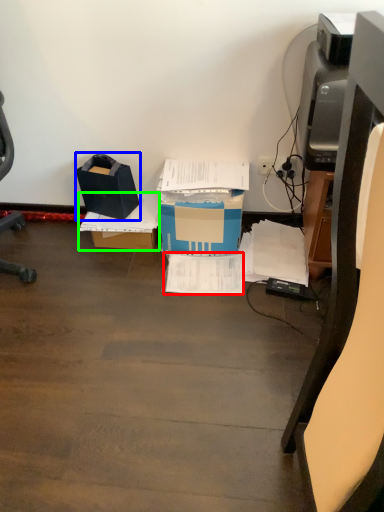
Question: Based on their relative distances, which object is farther from document (highlighted by a red box)? Choose from box (highlighted by a blue box) and cardboard box (highlighted by a green box).

Choices:
 (A) box
 (B) cardboard box

Answer: (A)